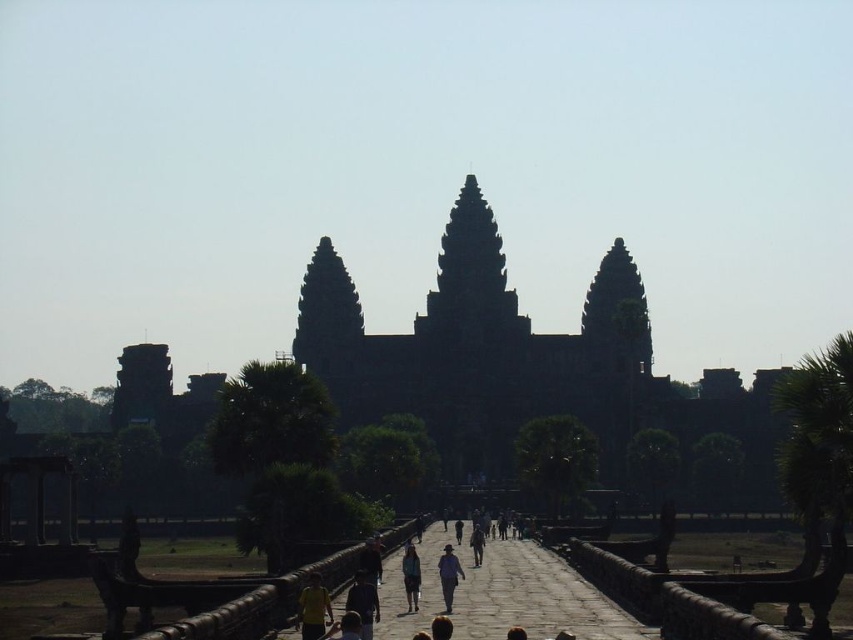
Is point (444, 552) closer to camera compared to point (409, 600)?

No, it is not.

Does dark blue jeans at center appear on the left side of blue fabric person at center?

No, dark blue jeans at center is not to the left of blue fabric person at center.

Measure the distance between dark blue jeans at center and camera.

dark blue jeans at center and camera are 403.58 feet apart.

The width and height of the screenshot is (853, 640). What are the coordinates of `dark blue jeans at center` in the screenshot? It's located at (448, 576).

Between dark blue jeans at center and dark brown leather jacket at center, which one has less height?

dark brown leather jacket at center

Who is positioned more to the right, dark blue jeans at center or dark brown leather jacket at center?

dark brown leather jacket at center

Locate an element on the screen. The image size is (853, 640). dark blue jeans at center is located at coordinates [x=448, y=576].

Between brown stone path at center and dark brown leather jacket at center, which one appears on the right side from the viewer's perspective?

From the viewer's perspective, dark brown leather jacket at center appears more on the right side.

Does point (631, 625) lie behind point (480, 540)?

No, it is not.

I want to click on brown stone path at center, so click(x=503, y=595).